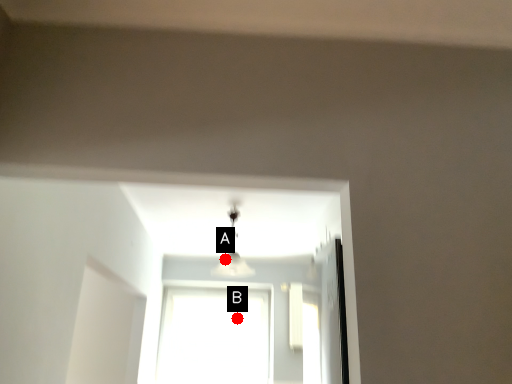
Question: Two points are circled on the image, labeled by A and B beside each circle. Which point is closer to the camera?

Choices:
 (A) A is closer
 (B) B is closer

Answer: (A)